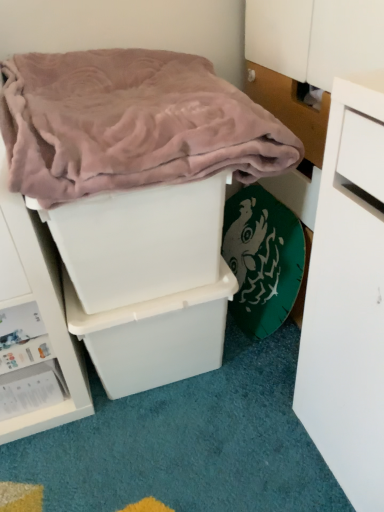
Question: Which is correct: pink plush blanket at upper left is inside white plastic storage box at center, which ranks as the 3th storage box in bottom-to-top order, or outside of it?

Choices:
 (A) outside
 (B) inside

Answer: (A)

Question: Is pink plush blanket at upper left in front of or behind white plastic storage box at center, placed as the 1th storage box when sorted from top to bottom, in the image?

Choices:
 (A) behind
 (B) front

Answer: (B)

Question: Estimate the real-world distances between objects in this image. Which object is closer to the white plastic storage box at center, marked as the 2th storage box in a bottom-to-top arrangement?

Choices:
 (A) pink plush blanket at upper left
 (B) white plastic storage box at lower left, acting as the 3th storage box starting from the top
 (C) white plastic storage box at center, which ranks as the 3th storage box in bottom-to-top order

Answer: (C)

Question: Which is nearer to the white plastic storage box at center, placed as the 2th storage box when sorted from top to bottom?

Choices:
 (A) white plastic storage box at center, placed as the 1th storage box when sorted from top to bottom
 (B) white plastic storage box at lower left, acting as the 3th storage box starting from the top
 (C) pink plush blanket at upper left

Answer: (A)